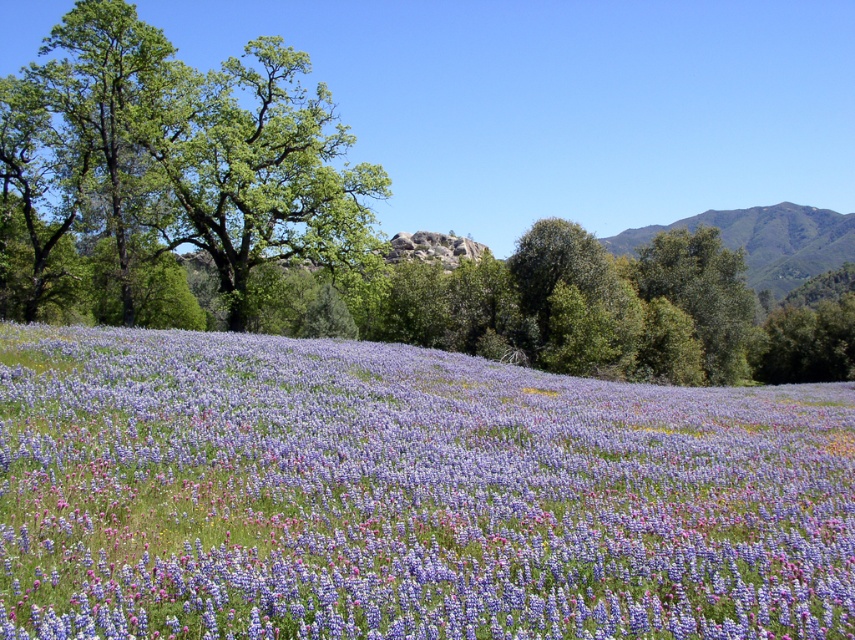
Who is more distant from viewer, (528, 413) or (240, 68)?

Positioned behind is point (240, 68).

The width and height of the screenshot is (855, 640). What do you see at coordinates (405, 496) in the screenshot?
I see `purple matte flower at center` at bounding box center [405, 496].

The width and height of the screenshot is (855, 640). Find the location of `purple matte flower at center`. purple matte flower at center is located at coordinates (405, 496).